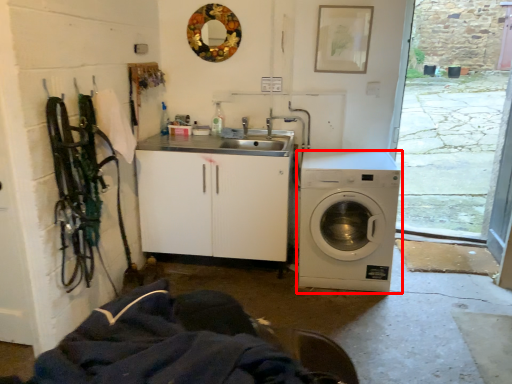
Question: From the image, what is the correct spatial relationship of washing machine (annotated by the red box) in relation to mirror?

Choices:
 (A) left
 (B) right

Answer: (B)